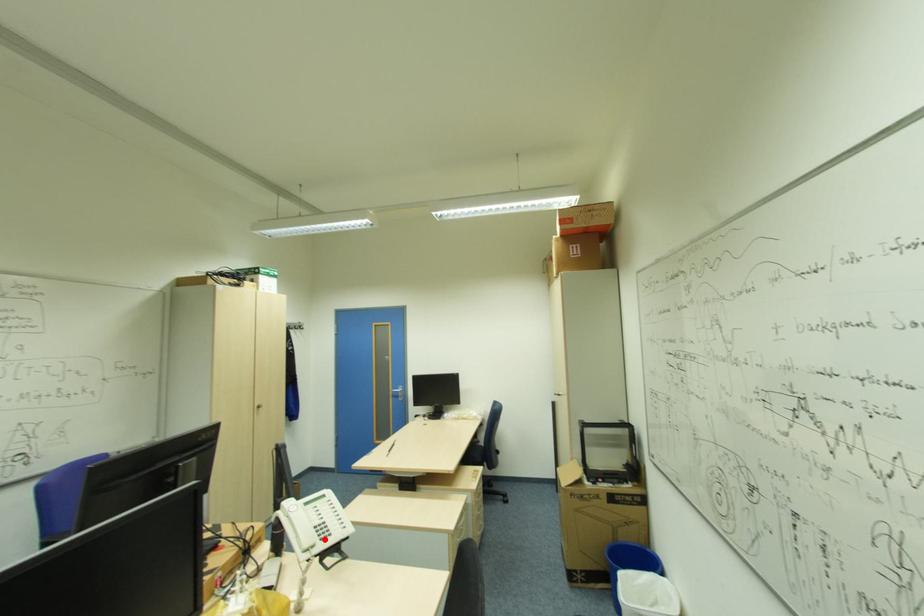
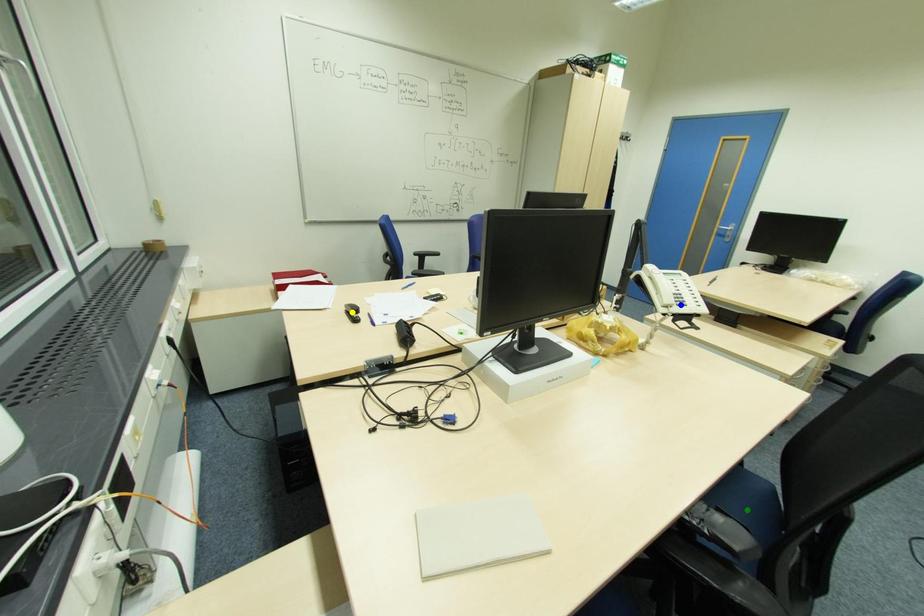
Question: I am providing you with two images of the same scene from different viewpoints. A red point is marked on the first image. You are given multiple points on the second image. Which mark in image 2 goes with the point in image 1?

Choices:
 (A) green point
 (B) blue point
 (C) yellow point

Answer: (B)